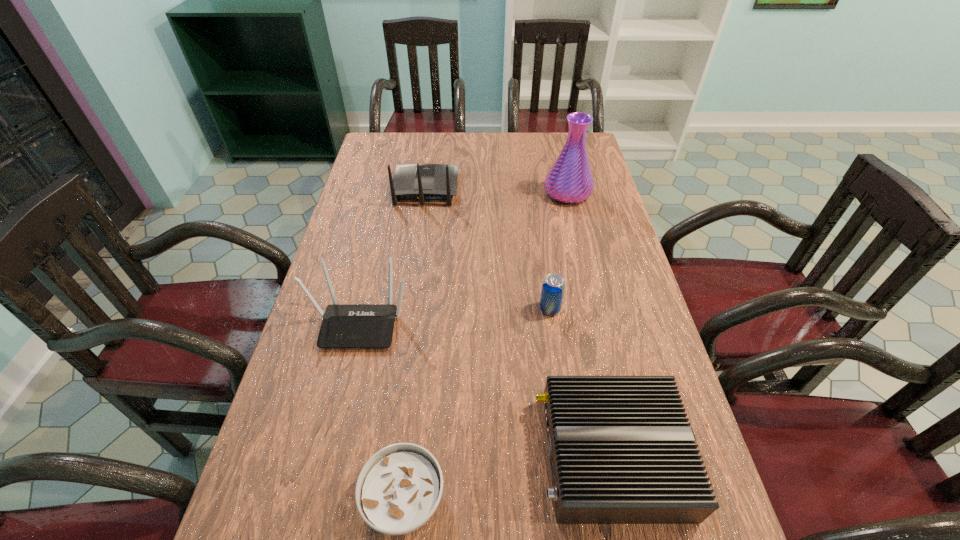
Find the location of `vacant space located on the front-facing side of the second farthest router`. vacant space located on the front-facing side of the second farthest router is located at coordinates (310, 537).

At what (x,y) coordinates should I click in order to perform the action: click on vacant space situated 0.180m on the left of the beer can. Please return your answer as a coordinate pair (x, y). This screenshot has width=960, height=540. Looking at the image, I should click on (470, 308).

Where is `vacant space located on the back panel of the rightmost router`? This screenshot has height=540, width=960. vacant space located on the back panel of the rightmost router is located at coordinates (415, 455).

Locate an element on the screen. The width and height of the screenshot is (960, 540). vacant space located 0.190m on the back panel of the rightmost router is located at coordinates (444, 455).

This screenshot has height=540, width=960. I want to click on free space located on the back panel of the rightmost router, so click(469, 455).

Identify the location of vase that is at the right edge. The width and height of the screenshot is (960, 540). (570, 180).

I want to click on router that is at the right edge, so pos(621,449).

The height and width of the screenshot is (540, 960). I want to click on vacant region at the far edge of the desktop, so click(x=514, y=141).

The image size is (960, 540). I want to click on free space at the left edge of the desktop, so click(382, 228).

In the image, there is a desktop. Identify the location of vacant area at the right edge. (688, 538).